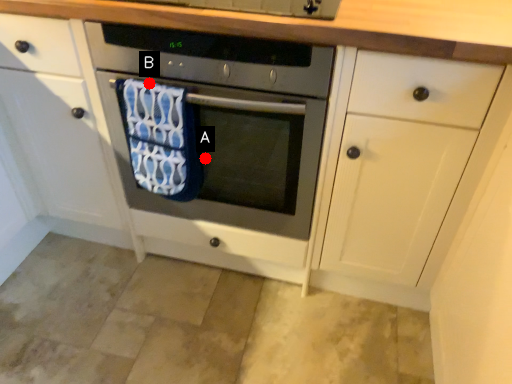
Question: Two points are circled on the image, labeled by A and B beside each circle. Which of the following is the farthest from the observer?

Choices:
 (A) A is further
 (B) B is further

Answer: (A)